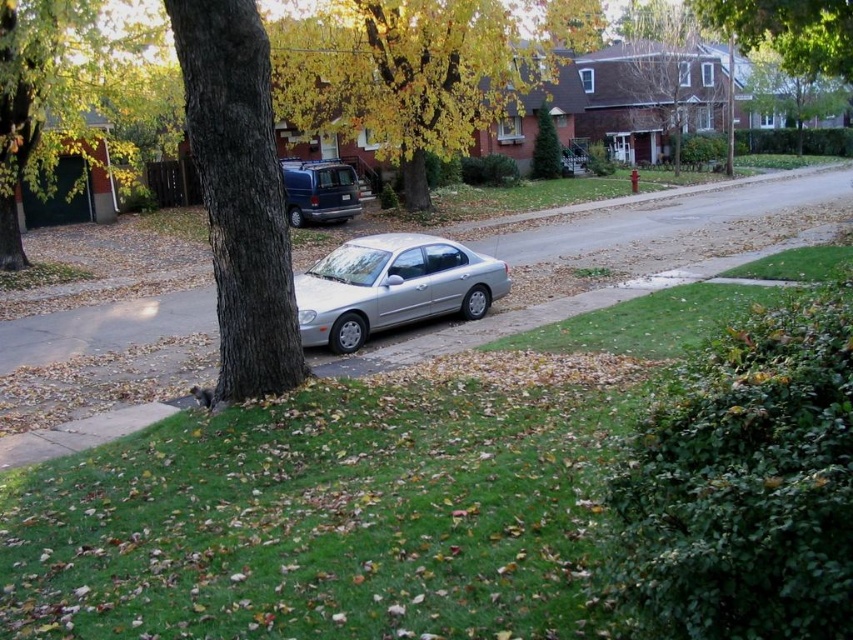
Describe the element at coordinates (392, 285) in the screenshot. I see `silver metallic sedan at center` at that location.

Locate an element on the screen. This screenshot has width=853, height=640. silver metallic sedan at center is located at coordinates (392, 285).

Is point (20, 77) closer to camera compared to point (283, 202)?

No, (20, 77) is further to viewer.

Based on the photo, is smooth brown tree trunk at left positioned in front of matte blue van at center?

That is False.

Locate an element on the screen. smooth brown tree trunk at left is located at coordinates (54, 93).

Where is `smooth brown tree trunk at left`? The image size is (853, 640). smooth brown tree trunk at left is located at coordinates (54, 93).

Does smooth bark tree at center have a smaller size compared to smooth brown tree trunk at left?

Yes.

Which is in front, point (212, 74) or point (77, 192)?

Point (212, 74)

Where is `smooth bark tree at center`? The image size is (853, 640). smooth bark tree at center is located at coordinates (239, 193).